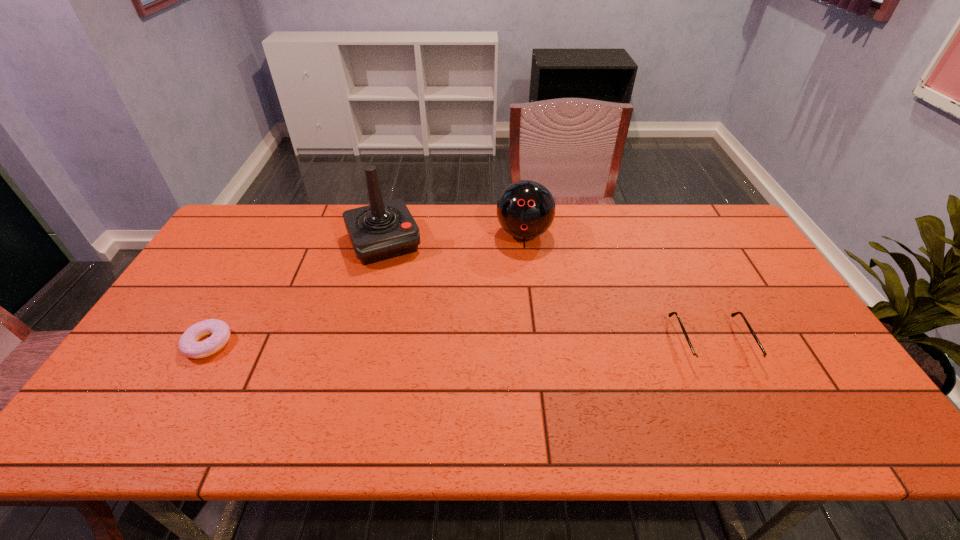
In the image, there is a desktop. Identify the location of vacant space at the far edge. The width and height of the screenshot is (960, 540). (324, 234).

Where is `vacant space at the near edge`? The image size is (960, 540). vacant space at the near edge is located at coordinates (327, 374).

At what (x,y) coordinates should I click in order to perform the action: click on vacant region at the right edge of the desktop. Please return your answer as a coordinate pair (x, y). Looking at the image, I should click on (756, 272).

At what (x,y) coordinates should I click in order to perform the action: click on free space between the tallest object and the shortest object. Please return your answer as a coordinate pair (x, y). Looking at the image, I should click on (296, 293).

The width and height of the screenshot is (960, 540). I want to click on vacant space that is in between the second shortest object and the joystick, so click(547, 293).

Identify the location of vacant space that is in between the tallest object and the shortest object. Image resolution: width=960 pixels, height=540 pixels. click(296, 293).

Where is `free space between the doughnut and the tallest object`? free space between the doughnut and the tallest object is located at coordinates (296, 293).

At what (x,y) coordinates should I click in order to perform the action: click on blank region between the joystick and the shortest object. Please return your answer as a coordinate pair (x, y). Looking at the image, I should click on (296, 293).

Locate an element on the screen. The image size is (960, 540). vacant point located between the spectacles and the third object from left to right is located at coordinates (617, 288).

Where is `free area in between the leftmost object and the tallest object`? free area in between the leftmost object and the tallest object is located at coordinates (296, 293).